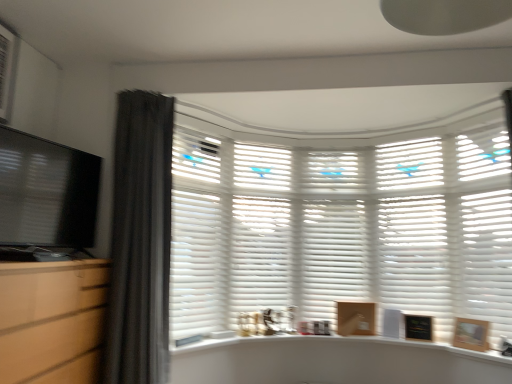
Find the location of a particular element. blank area to the left of black matte picture frame at lower right, which is the second picture frame from front to back is located at coordinates (404, 339).